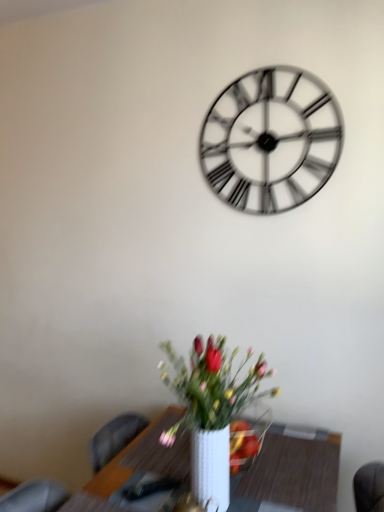
Question: In terms of width, does metallic silver clock at upper center look wider or thinner when compared to white ceramic vase at lower center?

Choices:
 (A) wide
 (B) thin

Answer: (B)

Question: In the image, is metallic silver clock at upper center positioned in front of or behind white ceramic vase at lower center?

Choices:
 (A) front
 (B) behind

Answer: (B)

Question: Estimate the real-world distances between objects in this image. Which object is closer to the white glossy table at lower center?

Choices:
 (A) metallic silver clock at upper center
 (B) white ceramic vase at lower center

Answer: (B)

Question: Considering the real-world distances, which object is farthest from the white ceramic vase at lower center?

Choices:
 (A) metallic silver clock at upper center
 (B) white glossy table at lower center

Answer: (A)